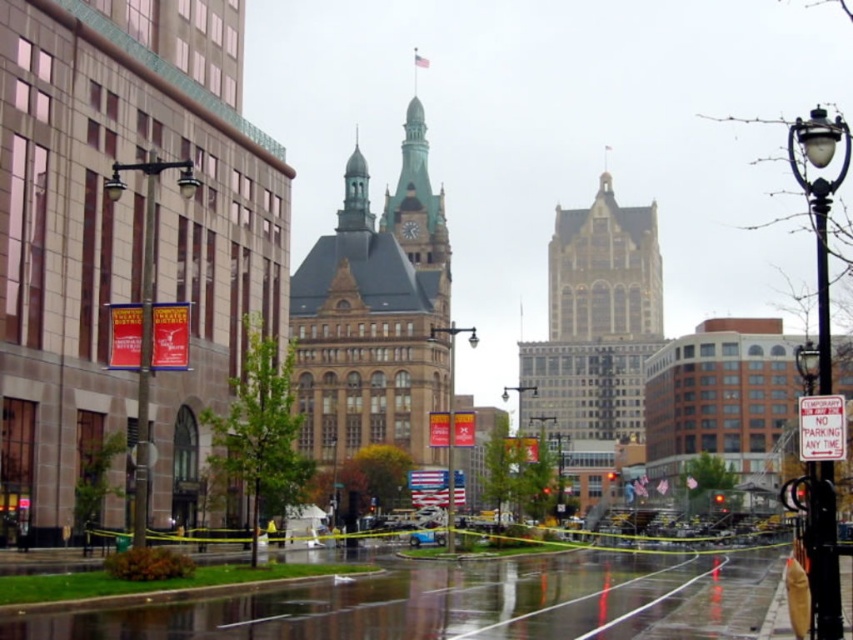
Question: Can you confirm if polished metal streetlight at left is positioned above metallic streetlamp at center?

Choices:
 (A) no
 (B) yes

Answer: (B)

Question: Which of the following is the closest to the observer?

Choices:
 (A) (453, 403)
 (B) (138, 499)
 (C) (415, 140)

Answer: (B)

Question: Which of the following is the closest to the observer?

Choices:
 (A) metallic streetlamp at center
 (B) black metal streetlight at right
 (C) brown stone clock tower at center
 (D) golden stone tower at center

Answer: (B)

Question: Can you confirm if golden stone tower at center is wider than black glass streetlight at center?

Choices:
 (A) yes
 (B) no

Answer: (A)

Question: Does golden stone tower at center come behind black metal streetlight at right?

Choices:
 (A) yes
 (B) no

Answer: (A)

Question: Which of the following is the closest to the observer?

Choices:
 (A) (416, 392)
 (B) (825, 236)

Answer: (B)